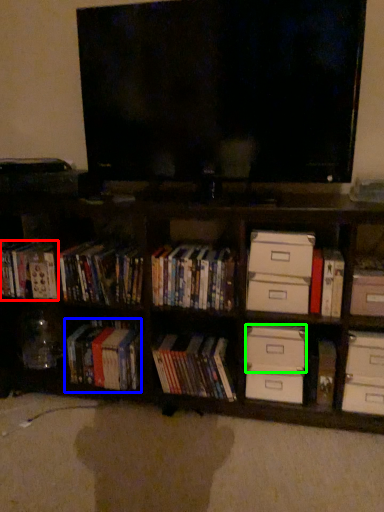
Question: Which object is positioned farthest from book (highlighted by a red box)? Select from book (highlighted by a blue box) and drawer (highlighted by a green box).

Choices:
 (A) book
 (B) drawer

Answer: (B)